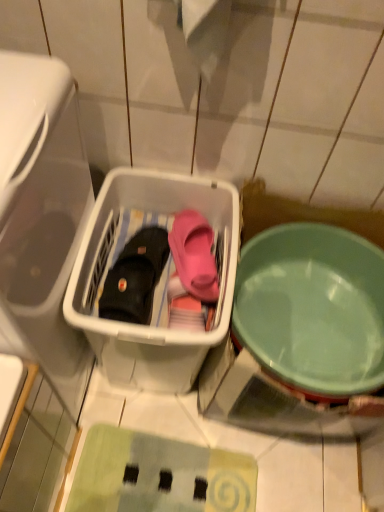
Question: Considering the positions of transparent plastic basket at left and white plastic basket at center in the image, is transparent plastic basket at left wider or thinner than white plastic basket at center?

Choices:
 (A) thin
 (B) wide

Answer: (A)

Question: Would you say transparent plastic basket at left is to the left or to the right of white plastic basket at center in the picture?

Choices:
 (A) right
 (B) left

Answer: (B)

Question: Estimate the real-world distances between objects in this image. Which object is closer to the white plastic basket at center?

Choices:
 (A) light green plastic bowl at right
 (B) transparent plastic basket at left
 (C) black leather boot at center

Answer: (C)

Question: Which of these objects is positioned farthest from the light green plastic bowl at right?

Choices:
 (A) black leather boot at center
 (B) white plastic basket at center
 (C) transparent plastic basket at left

Answer: (C)